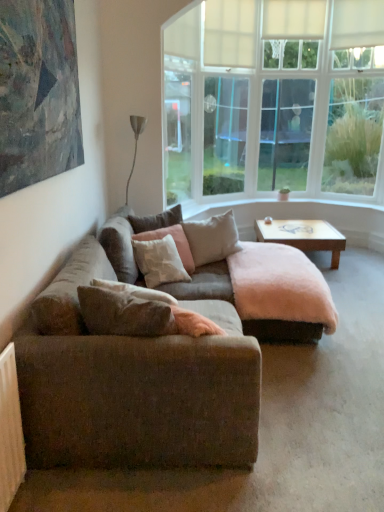
Question: In terms of size, does textured brown couch at center appear bigger or smaller than textured canvas painting at upper left?

Choices:
 (A) small
 (B) big

Answer: (B)

Question: Is textured brown couch at center spatially inside textured canvas painting at upper left, or outside of it?

Choices:
 (A) inside
 (B) outside

Answer: (B)

Question: Based on their relative distances, which object is nearer to the wooden at center?

Choices:
 (A) beige fabric pillow at center, which appears as the 3th pillow when viewed from the front
 (B) textured canvas painting at upper left
 (C) white soft pillow at center, the third pillow viewed from the back
 (D) cotton/pink pillow at center, which is the 4th pillow from back to front
 (E) metallic silver floor lamp at upper left

Answer: (A)

Question: Considering the real-world distances, which object is farthest from the textured brown couch at center?

Choices:
 (A) textured brown couch at center
 (B) textured canvas painting at upper left
 (C) cotton/pink pillow at center, which is the 4th pillow from back to front
 (D) beige fabric pillow at center, which is the second pillow from back to front
 (E) metallic silver floor lamp at upper left

Answer: (E)